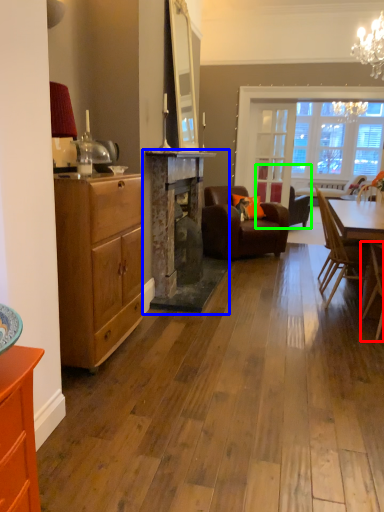
Question: Which object is positioned closest to chair (highlighted by a red box)? Select from fireplace (highlighted by a blue box) and chair (highlighted by a green box).

Choices:
 (A) fireplace
 (B) chair

Answer: (A)